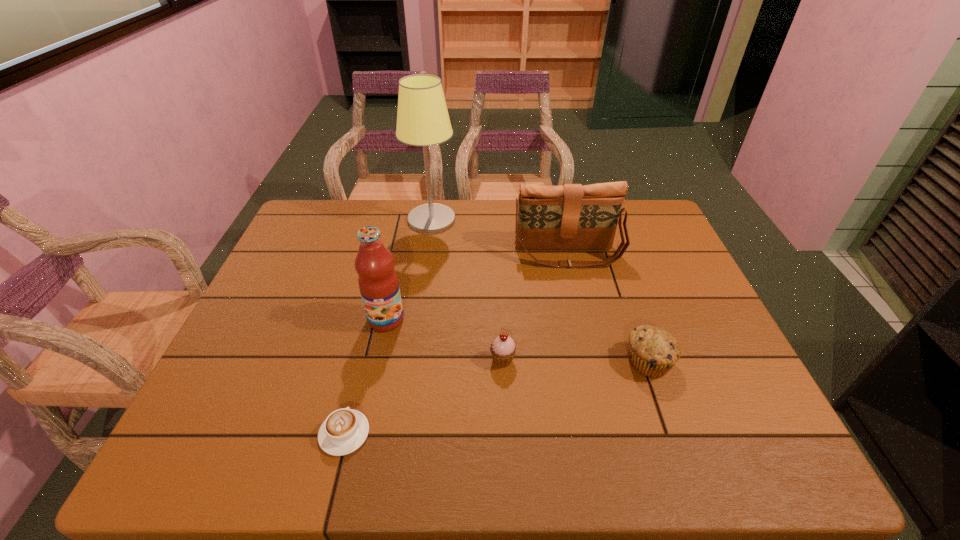
Identify the location of table lamp. This screenshot has width=960, height=540. (422, 118).

The width and height of the screenshot is (960, 540). What are the coordinates of `the farthest object` in the screenshot? It's located at click(x=422, y=118).

Locate an element on the screen. This screenshot has height=540, width=960. fruit juice is located at coordinates (378, 282).

Locate an element on the screen. the second tallest object is located at coordinates (378, 282).

Image resolution: width=960 pixels, height=540 pixels. Identify the location of the fourth shortest object. (566, 217).

The width and height of the screenshot is (960, 540). What are the coordinates of `shoulder bag` in the screenshot? It's located at (566, 217).

Where is `muffin`? The image size is (960, 540). muffin is located at coordinates (652, 351).

Identify the location of the fourth object from left to right. The height and width of the screenshot is (540, 960). (502, 349).

I want to click on the shortest object, so click(x=344, y=430).

Image resolution: width=960 pixels, height=540 pixels. Identify the location of cappuccino. (344, 430).